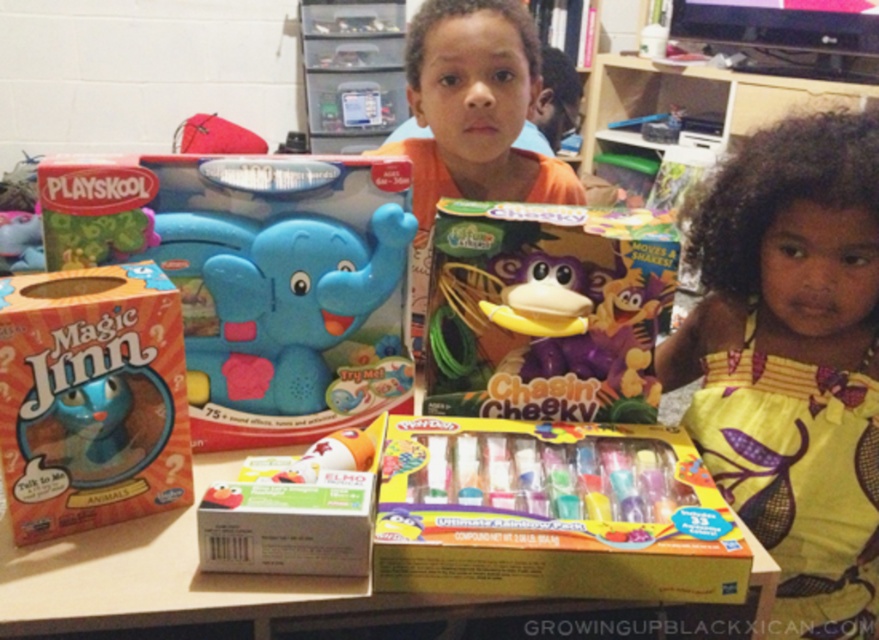
This screenshot has height=640, width=879. What do you see at coordinates (792, 360) in the screenshot?
I see `yellow printed fabric at right` at bounding box center [792, 360].

Does point (830, 472) come farther from viewer compared to point (346, 461)?

Yes, it is behind point (346, 461).

What do you see at coordinates (792, 360) in the screenshot? The image size is (879, 640). I see `yellow printed fabric at right` at bounding box center [792, 360].

Where is `yellow printed fabric at right`? yellow printed fabric at right is located at coordinates (792, 360).

Who is lower down, purple matte toy at center or matte plastic elephant at center?

purple matte toy at center is lower down.

Can you confirm if purple matte toy at center is smaller than matte plastic elephant at center?

No.

Measure the distance between point [476,244] and camera.

Point [476,244] is 36.43 inches from camera.

The height and width of the screenshot is (640, 879). I want to click on purple matte toy at center, so [x=546, y=310].

Is point (728, 570) positioned after point (64, 353)?

No.

Image resolution: width=879 pixels, height=640 pixels. I want to click on matte plastic play-doh at center, so click(551, 513).